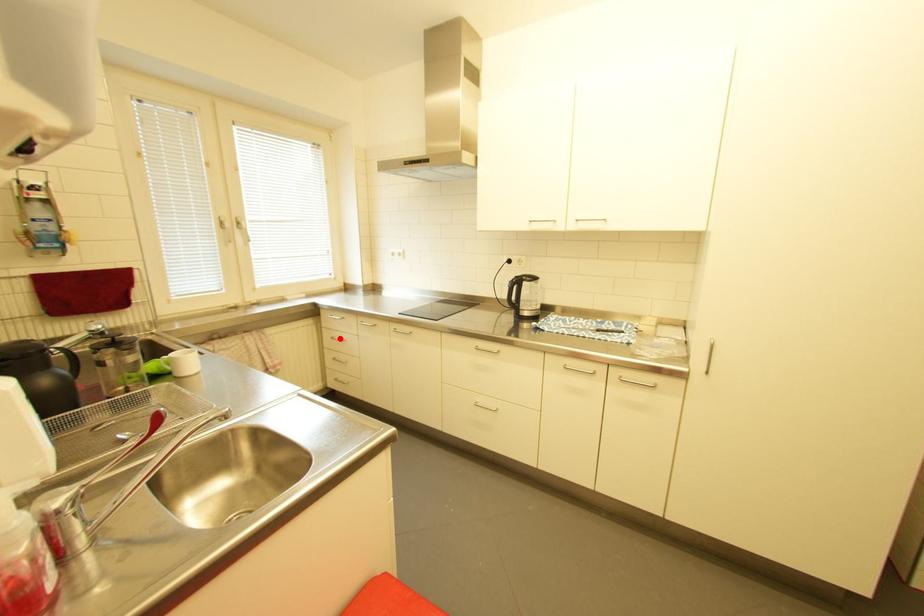
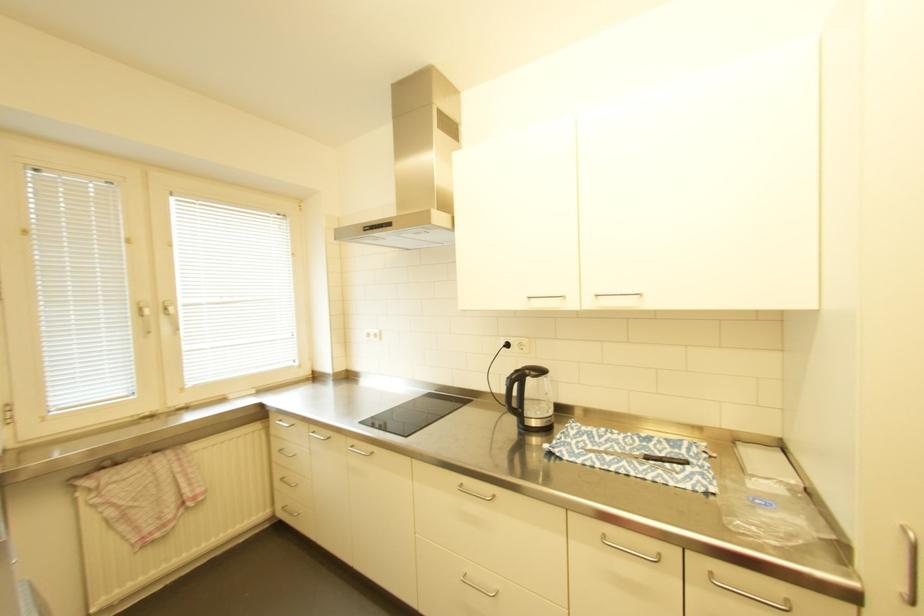
Question: I am providing you with two images of the same scene from different viewpoints. Image1 has a red point marked. In image2, the corresponding 3D location appears at what relative position? Reply with the corresponding letter.

Choices:
 (A) Closer
 (B) Farther

Answer: (B)